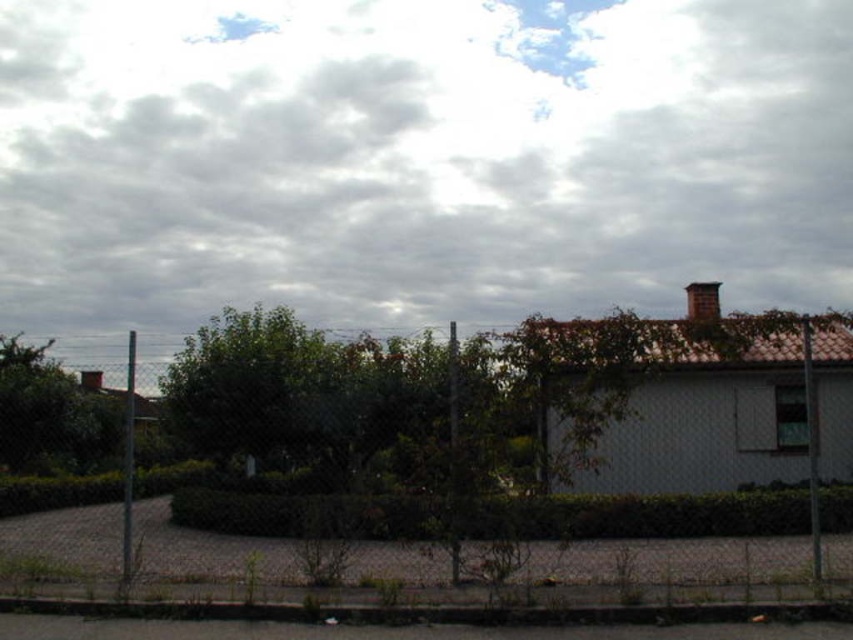
Does point (3, 502) come closer to viewer compared to point (686, 298)?

Yes.

Is point (334, 525) more distant than point (704, 316)?

No.

Between point (518, 497) and point (699, 300), which one is positioned in front?

Positioned in front is point (518, 497).

Locate an element on the screen. Image resolution: width=853 pixels, height=640 pixels. chain-link fence at center is located at coordinates (670, 506).

Which is in front, point (369, 228) or point (70, 531)?

Point (70, 531) is more forward.

Is cloudy sky at upper center in front of chain-link fence at center?

No, it is not.

Find the location of a particular element. cloudy sky at upper center is located at coordinates (415, 161).

Is point (786, 36) more distant than point (689, 317)?

Yes, point (786, 36) is farther from viewer.

Is point (831, 228) closer to camera compared to point (692, 305)?

No, (831, 228) is further to viewer.

Which is behind, point (685, 182) or point (706, 292)?

The point (685, 182) is behind.

Where is `cloudy sky at upper center`? cloudy sky at upper center is located at coordinates (415, 161).